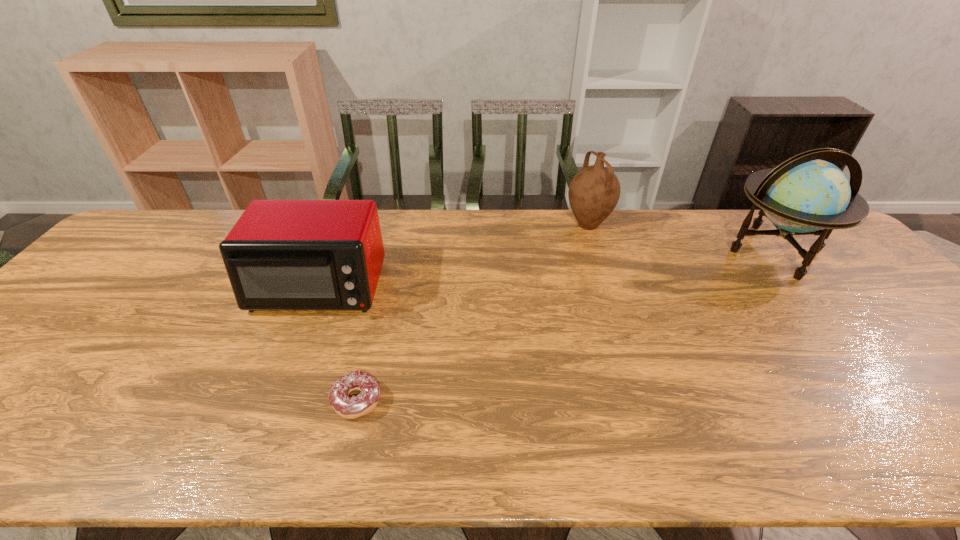
You are a GUI agent. You are given a task and a screenshot of the screen. Output one action in this format:
    pyautogui.click(x=<x>, y=<y>)
    Task: Click on the free space located 0.060m on the back of the doughnut
    The height and width of the screenshot is (540, 960).
    Given the screenshot: What is the action you would take?
    pyautogui.click(x=367, y=359)

Where is `globe that is at the far edge`? This screenshot has height=540, width=960. globe that is at the far edge is located at coordinates (803, 195).

Find the location of a particular element. The image size is (960, 540). pitcher at the far edge is located at coordinates (594, 191).

You are a GUI agent. You are given a task and a screenshot of the screen. Output one action in this format:
    pyautogui.click(x=<x>, y=<y>)
    Task: Click on the object that is at the near edge
    
    Given the screenshot: What is the action you would take?
    pyautogui.click(x=347, y=407)

Locate an element on the screen. The width and height of the screenshot is (960, 540). object at the right edge is located at coordinates (803, 195).

Locate an element on the screen. object that is positioned at the far right corner is located at coordinates (803, 195).

The image size is (960, 540). Identify the location of free space at the far edge. (460, 238).

In the image, there is a desktop. Where is `free space at the left edge`? The image size is (960, 540). free space at the left edge is located at coordinates (17, 368).

I want to click on free space at the right edge of the desktop, so click(x=948, y=369).

You are a GUI agent. You are given a task and a screenshot of the screen. Output one action in this format:
    pyautogui.click(x=<x>, y=<y>)
    Task: Click on the free spot between the toaster oven and the rightmost object
    This screenshot has width=960, height=540.
    Given the screenshot: What is the action you would take?
    pyautogui.click(x=546, y=269)